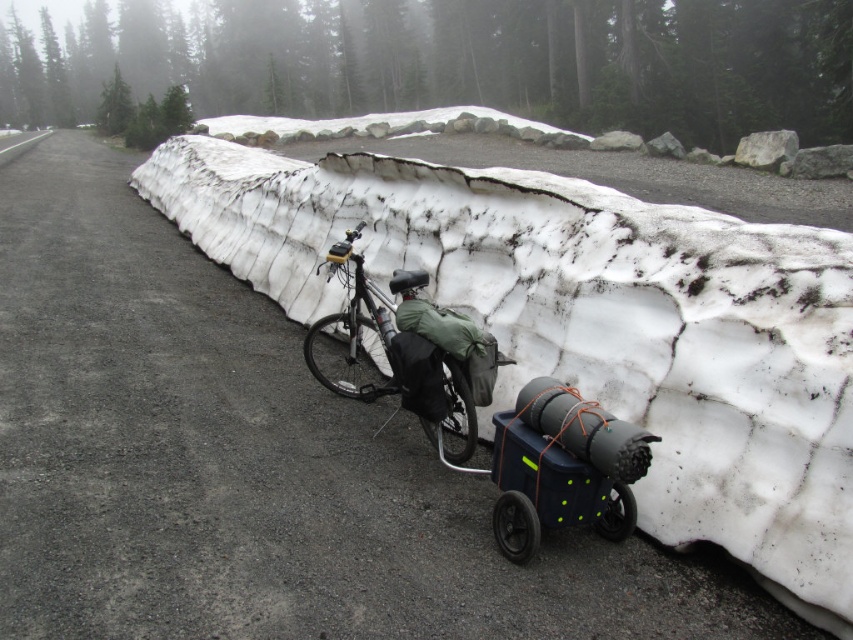
You are a delivery person who needs to place a package on the blue plastic cart at center. Where exactly should you place it?

The blue plastic cart at center is located at the coordinate point (561, 467), so place the package there.

You are a hiker trying to cross the road. There is a blue plastic cart at center and a matte black bicycle at center. Which object should you avoid stepping on to stay on the road?

You should avoid stepping on the blue plastic cart at center because it is to the right of the matte black bicycle at center, meaning it is closer to the snow bank bordering the road. Stepping on the cart might lead you off the road into the snow.